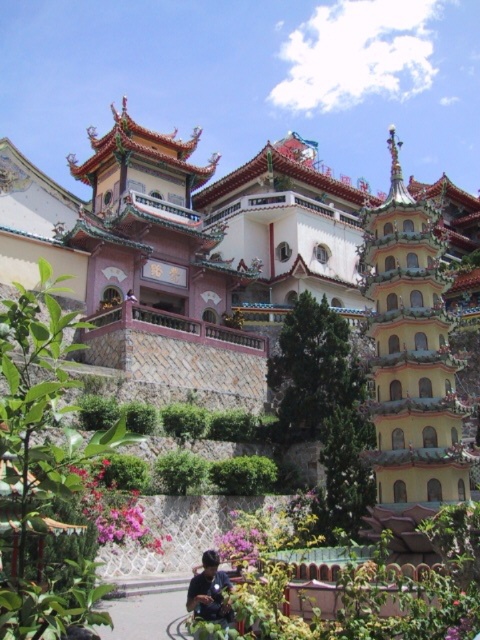
Does point (152, 534) come farther from viewer compared to point (189, 588)?

Yes, it is behind point (189, 588).

Between pink matte flowers at lower center and matte black shirt at lower center, which one is positioned lower?

matte black shirt at lower center is lower down.

Does point (147, 529) lie behind point (224, 579)?

Yes, it is.

Image resolution: width=480 pixels, height=640 pixels. In order to click on pink matte flowers at lower center in this screenshot , I will do [x=116, y=506].

Between white glossy palace at center and yellow glazed pagoda at right, which one appears on the left side from the viewer's perspective?

From the viewer's perspective, white glossy palace at center appears more on the left side.

From the picture: Is white glossy palace at center further to the viewer compared to yellow glazed pagoda at right?

Yes, white glossy palace at center is further from the viewer.

Image resolution: width=480 pixels, height=640 pixels. Identify the location of white glossy palace at center. (216, 232).

Is white glossy palace at center wider than pink matte flowers at lower center?

Correct, the width of white glossy palace at center exceeds that of pink matte flowers at lower center.

Between point (197, 132) and point (120, 524), which one is positioned behind?

The point (197, 132) is behind.

Identify the location of white glossy palace at center. (216, 232).